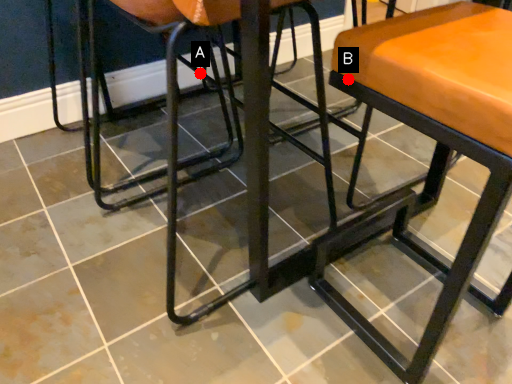
Question: Two points are circled on the image, labeled by A and B beside each circle. Which point is farther to the camera?

Choices:
 (A) A is further
 (B) B is further

Answer: (A)